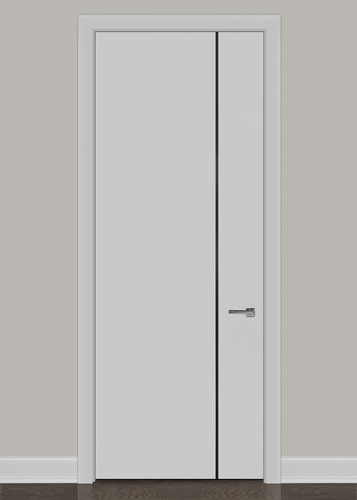
The image size is (357, 500). Find the location of `right doorframe`. right doorframe is located at coordinates (269, 351).